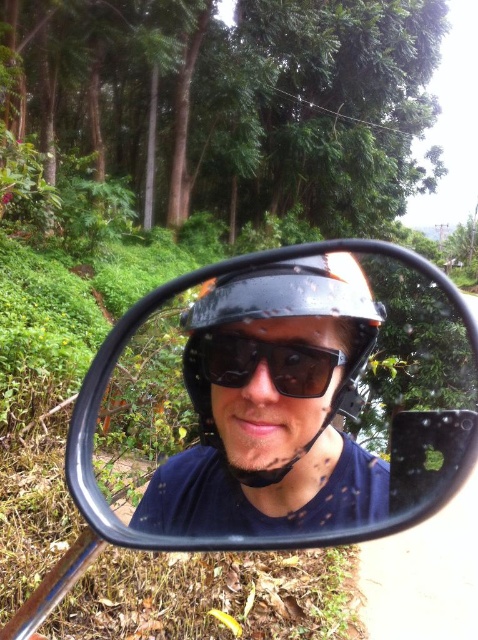
Question: Can you confirm if glossy black helmet at center is bigger than black matte sunglasses at center?

Choices:
 (A) no
 (B) yes

Answer: (B)

Question: Based on their relative distances, which object is farther from the glossy black helmet at center?

Choices:
 (A) black matte mirror at center
 (B) black matte sunglasses at center

Answer: (A)

Question: From the image, what is the correct spatial relationship of black matte mirror at center in relation to glossy black helmet at center?

Choices:
 (A) above
 (B) below

Answer: (A)

Question: Considering the real-world distances, which object is closest to the black matte sunglasses at center?

Choices:
 (A) glossy black helmet at center
 (B) black matte mirror at center

Answer: (A)

Question: Does black matte mirror at center have a greater width compared to glossy black helmet at center?

Choices:
 (A) yes
 (B) no

Answer: (A)

Question: Which is nearer to the black matte mirror at center?

Choices:
 (A) glossy black helmet at center
 (B) black matte sunglasses at center

Answer: (A)